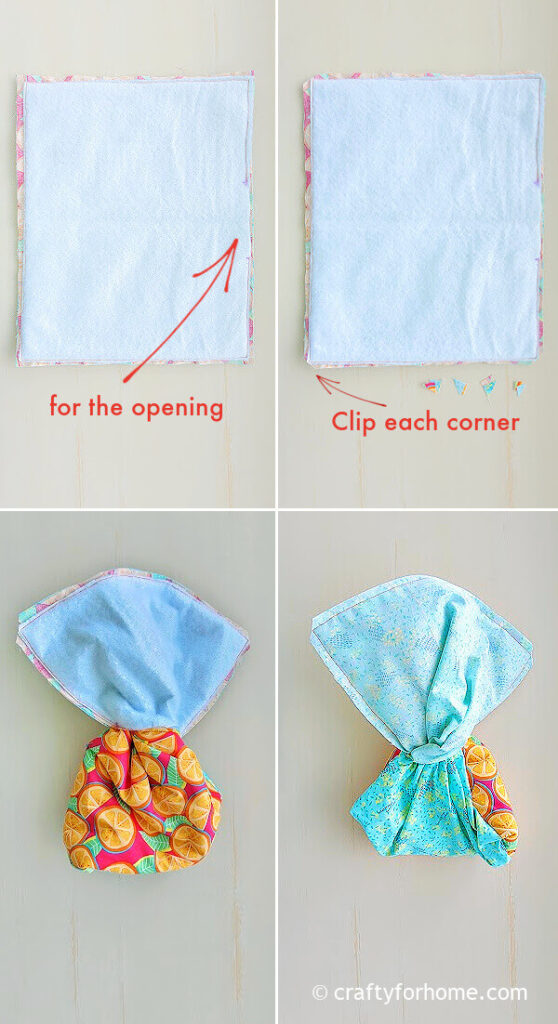
This screenshot has width=558, height=1024. Find the location of `multicolored fabric`. multicolored fabric is located at coordinates (114, 812), (171, 788), (490, 799).